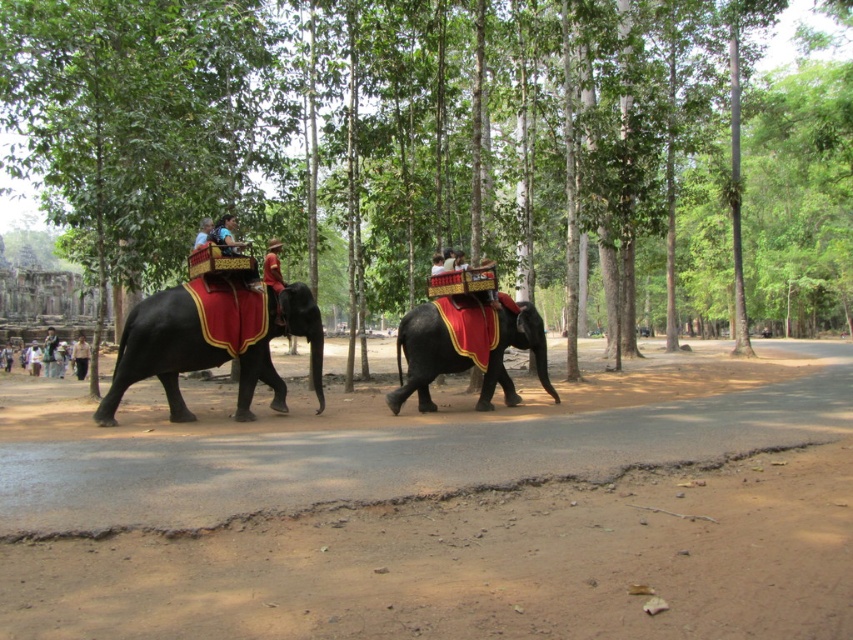
Is shiny black elephant at center wider than smooth brown skin at center?

Yes.

Can you confirm if shiny black elephant at center is positioned above smooth brown skin at center?

No, shiny black elephant at center is not above smooth brown skin at center.

Find the location of a particular element. shiny black elephant at center is located at coordinates tap(422, 356).

At what (x,y) coordinates should I click in order to perform the action: click on shiny black elephant at center. Please return your answer as a coordinate pair (x, y). This screenshot has height=640, width=853. Looking at the image, I should click on (422, 356).

Can you confirm if shiny black elephant at left is bigger than light beige cotton shirt at center?

No, shiny black elephant at left is not bigger than light beige cotton shirt at center.

Can you confirm if shiny black elephant at left is thinner than light beige cotton shirt at center?

Indeed, shiny black elephant at left has a lesser width compared to light beige cotton shirt at center.

Identify the location of shiny black elephant at left. (160, 352).

Who is lower down, green leafy tree at center or shiny black elephant at left?

shiny black elephant at left is below.

Is point (767, 138) farther from camera compared to point (180, 412)?

Yes, point (767, 138) is behind point (180, 412).

What are the coordinates of `green leafy tree at center` in the screenshot? It's located at (444, 141).

This screenshot has width=853, height=640. What are the coordinates of `green leafy tree at center` in the screenshot? It's located at (444, 141).